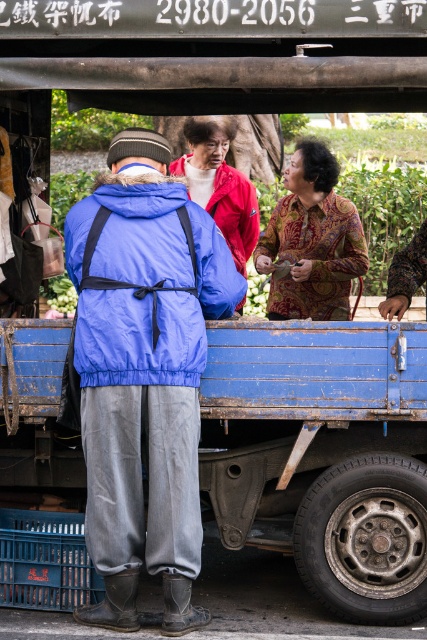
You are standing in front of the blue truck and see two points marked on the truck bed. Which point is closer to you, point [166,289] or point [336,237]?

Point [166,289] is closer to the viewer than point [336,237].